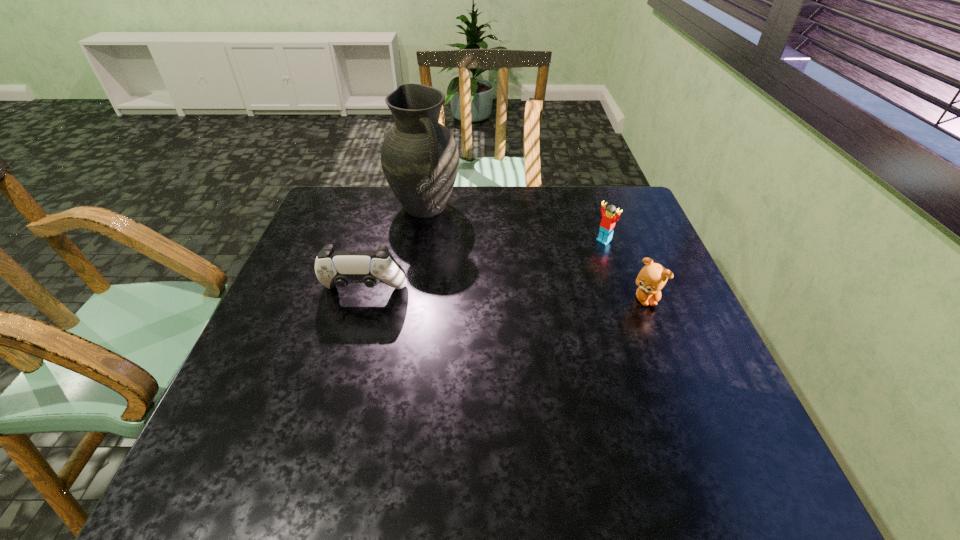
Locate an element on the screen. The image size is (960, 540). vacant space at the far left corner of the desktop is located at coordinates pyautogui.click(x=346, y=214).

The height and width of the screenshot is (540, 960). In the image, there is a desktop. In order to click on vacant area at the near right corner in this screenshot , I will do `click(714, 430)`.

Find the location of a particular element. The height and width of the screenshot is (540, 960). free point between the pitcher and the teddy bear is located at coordinates (535, 253).

Where is `vacant space that's between the tallest object and the Lego`? The width and height of the screenshot is (960, 540). vacant space that's between the tallest object and the Lego is located at coordinates (515, 224).

Image resolution: width=960 pixels, height=540 pixels. Identify the location of empty space between the teddy bear and the Lego. (625, 270).

The image size is (960, 540). Identify the location of empty space between the second farthest object and the control. (484, 267).

At what (x,y) coordinates should I click in order to perform the action: click on vacant space in between the control and the third nearest object. Please return your answer as a coordinate pair (x, y). Looking at the image, I should click on (484, 267).

Locate an element on the screen. unoccupied position between the control and the farthest object is located at coordinates (395, 251).

Identify the location of unoccupied position between the teddy bear and the Lego. Image resolution: width=960 pixels, height=540 pixels. (625, 270).

The width and height of the screenshot is (960, 540). I want to click on vacant area between the Lego and the teddy bear, so click(625, 270).